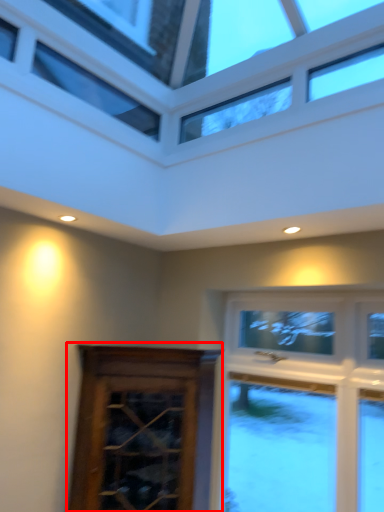
Question: From the image's perspective, where is screen door (annotated by the red box) located in relation to window in the image?

Choices:
 (A) below
 (B) above

Answer: (A)